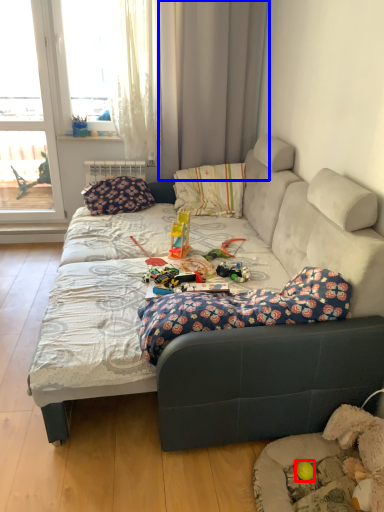
Question: Among these objects, which one is nearest to the camera, toy (highlighted by a red box) or curtain (highlighted by a blue box)?

Choices:
 (A) toy
 (B) curtain

Answer: (A)